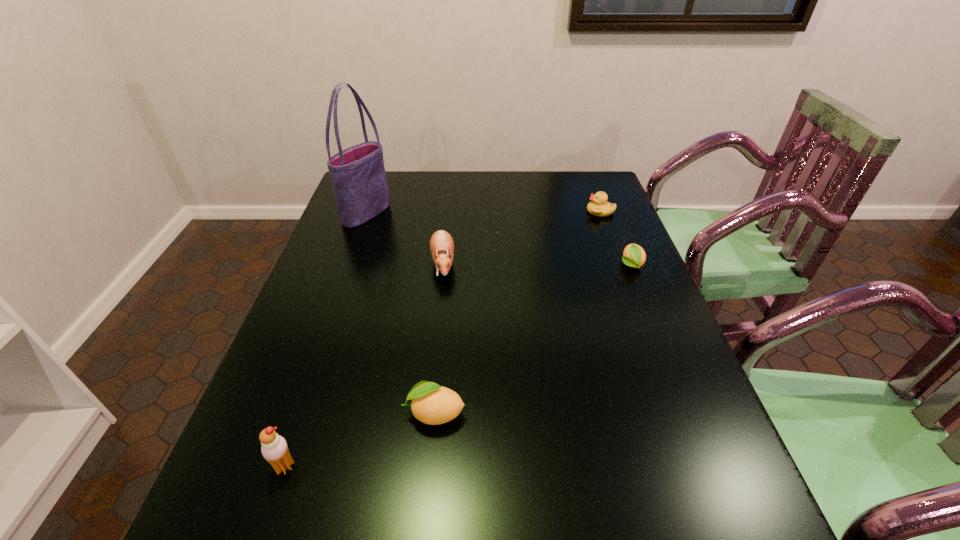
Image resolution: width=960 pixels, height=540 pixels. I want to click on free space located 0.300m with leaves positioned above the left lemon, so click(255, 413).

The width and height of the screenshot is (960, 540). Identify the location of vacant space located 0.130m with leaves positioned above the left lemon. (339, 413).

Where is `vacant space located 0.130m with leaves positioned above the shorter lemon`? vacant space located 0.130m with leaves positioned above the shorter lemon is located at coordinates (649, 310).

You are a GUI agent. You are given a task and a screenshot of the screen. Output one action in this format:
    pyautogui.click(x=<x>, y=<y>)
    Task: Click on the vacant point located 0.250m at the face of the hamster
    Image resolution: width=960 pixels, height=540 pixels.
    Given the screenshot: What is the action you would take?
    pyautogui.click(x=433, y=359)

At what (x,y) coordinates should I click in order to perform the action: click on free point located on the front-facing side of the duckling. Please return your answer as a coordinate pair (x, y). Image resolution: width=960 pixels, height=540 pixels. Looking at the image, I should click on (515, 211).

Locate an element on the screen. The image size is (960, 540). vacant space located on the front-facing side of the duckling is located at coordinates (511, 211).

Where is `vacant space located on the front-facing side of the duckling`? This screenshot has width=960, height=540. vacant space located on the front-facing side of the duckling is located at coordinates (568, 211).

In order to click on vacant space located 0.150m on the front of the tallest object in this screenshot , I will do `click(350, 259)`.

Where is `duckling at the far edge`? This screenshot has width=960, height=540. duckling at the far edge is located at coordinates (598, 206).

At what (x,y) coordinates should I click in order to perform the action: click on tote bag located at the far edge. Please return your answer as a coordinate pair (x, y). This screenshot has width=960, height=540. Looking at the image, I should click on (358, 176).